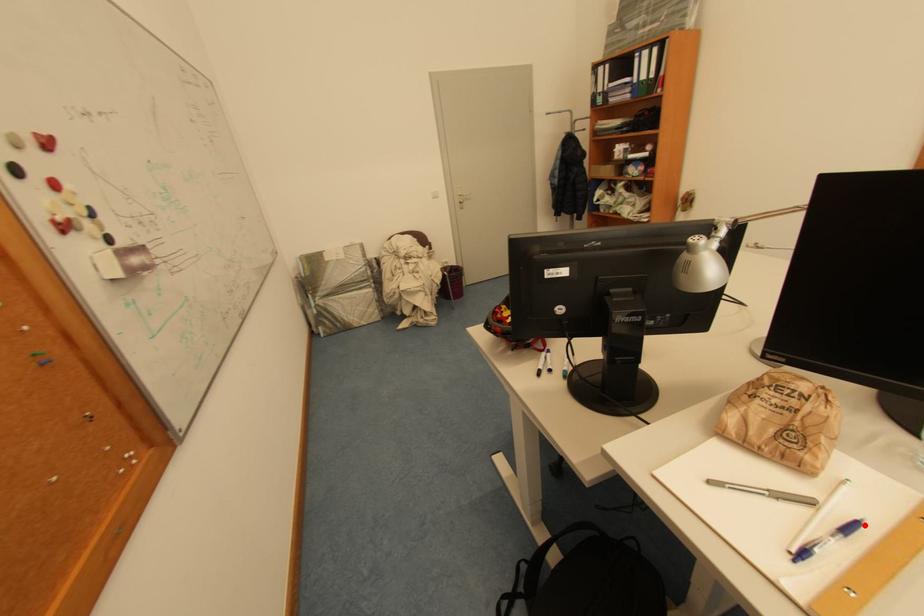
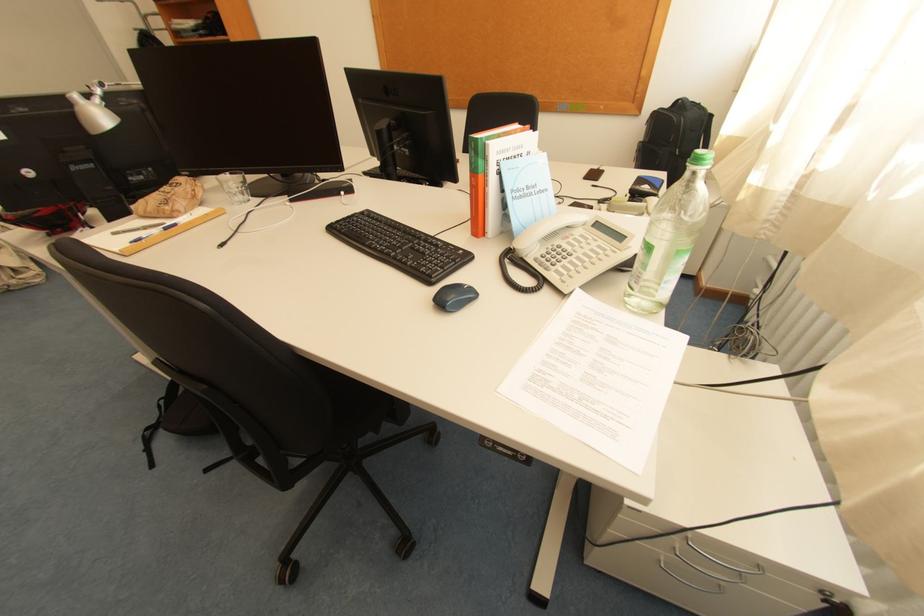
In the second image, find the point that corresponds to the highlighted location in the first image.

(184, 225)